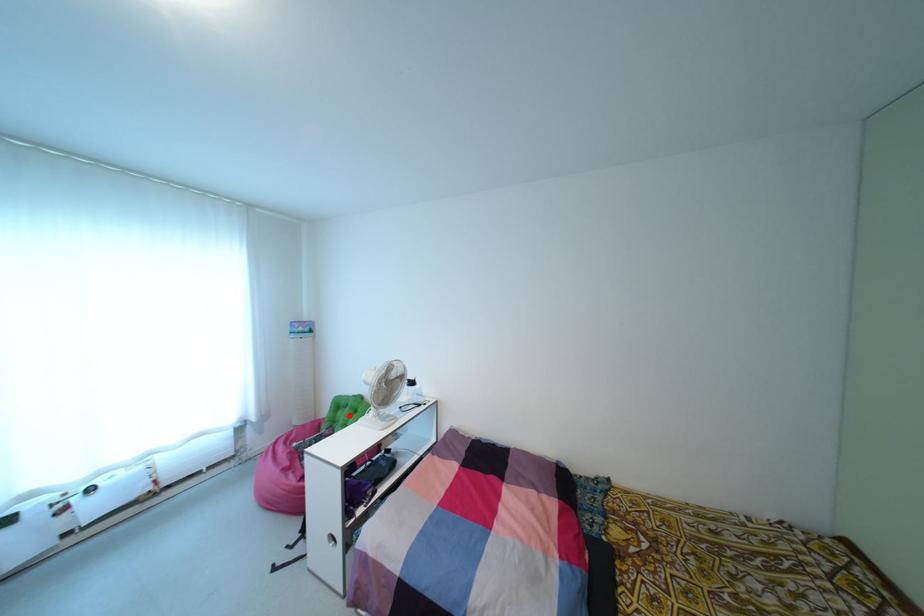
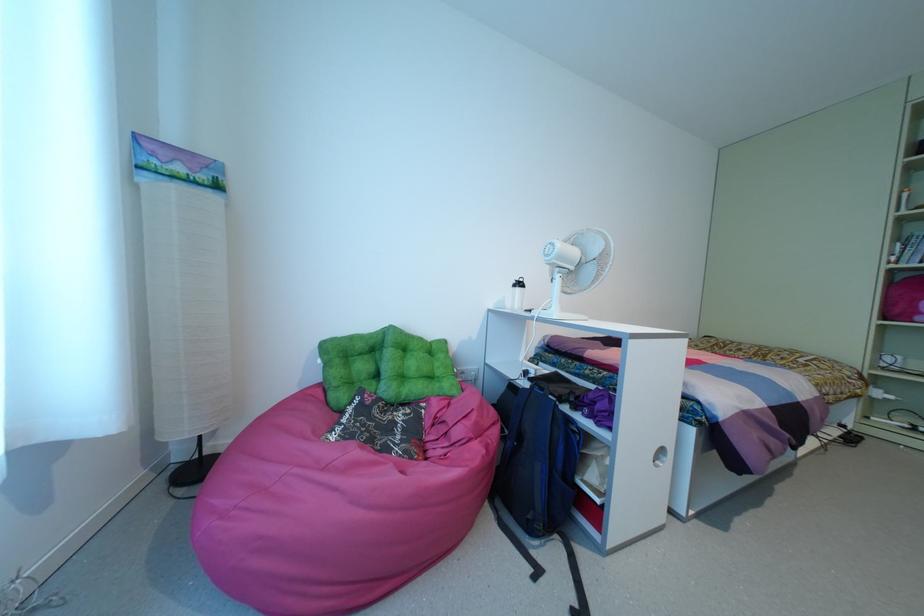
The point at the highlighted location is marked in the first image. Where is the corresponding point in the second image?

(402, 358)